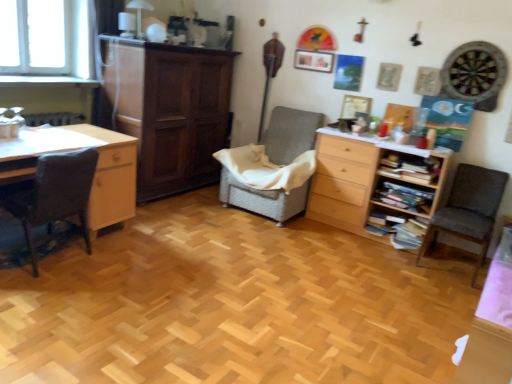
The height and width of the screenshot is (384, 512). I want to click on vacant area located to the right-hand side of dark gray fabric chair at left, the third chair from the right, so click(x=121, y=263).